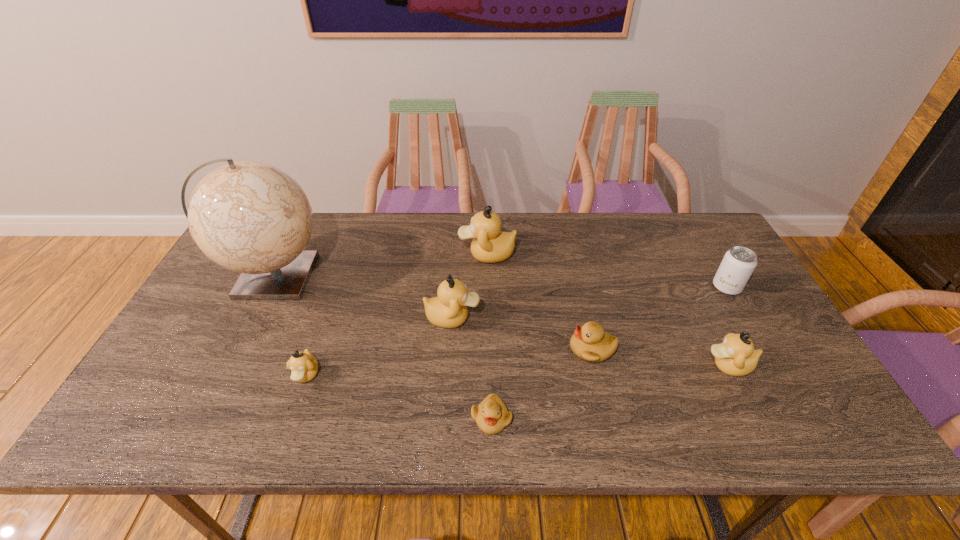
Where is `the leftmost object`? the leftmost object is located at coordinates (252, 218).

The height and width of the screenshot is (540, 960). I want to click on the tallest object, so click(x=252, y=218).

Locate an element on the screen. This screenshot has height=540, width=960. the biggest tan duckling is located at coordinates (490, 245).

You are a GUI agent. You are given a task and a screenshot of the screen. Output one action in this format:
    pyautogui.click(x=<x>, y=<y>)
    Task: Click on the farthest tan duckling
    
    Given the screenshot: What is the action you would take?
    pyautogui.click(x=490, y=245)

Find the location of a particular element. the second biggest tan duckling is located at coordinates point(449,310).

You are a GUI agent. You are given a task and a screenshot of the screen. Output one action in this format:
    pyautogui.click(x=<x>, y=<y>)
    Task: Click on the fifth shortest duckling
    Image resolution: width=960 pixels, height=540 pixels.
    Given the screenshot: What is the action you would take?
    pyautogui.click(x=449, y=310)

The image size is (960, 540). What are the coordinates of `soda can` in the screenshot? It's located at (738, 264).

At what (x,y) coordinates should I click in order to perform the action: click on the second smallest tan duckling. Please return your answer as a coordinate pair (x, y). The height and width of the screenshot is (540, 960). Looking at the image, I should click on (736, 356).

Identify the location of the rightmost tan duckling. (736, 356).

You are a GUI agent. You are given a task and a screenshot of the screen. Output one action in this format:
    pyautogui.click(x=<x>, y=<y>)
    Task: Click on the right yellow duckling
    
    Given the screenshot: What is the action you would take?
    pyautogui.click(x=590, y=343)